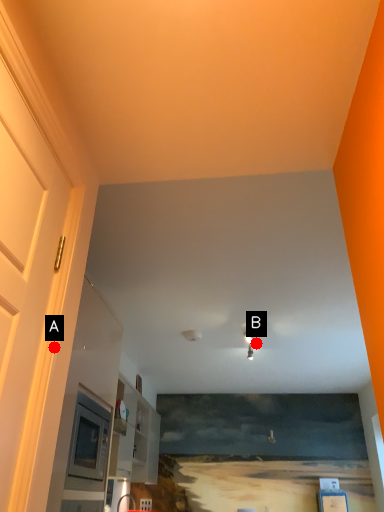
Question: Two points are circled on the image, labeled by A and B beside each circle. Which point is closer to the camera taking this photo?

Choices:
 (A) A is closer
 (B) B is closer

Answer: (A)